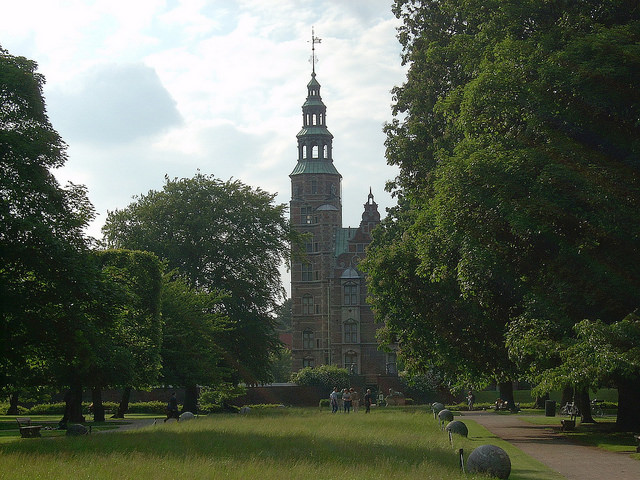
Where is `trashcan`? trashcan is located at coordinates (550, 408).